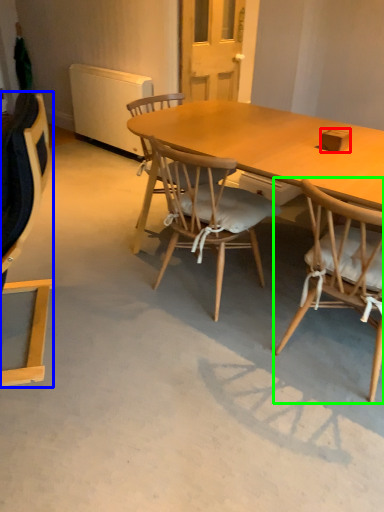
Question: Which is farther away from box (highlighted by a red box)? chair (highlighted by a blue box) or chair (highlighted by a green box)?

Choices:
 (A) chair
 (B) chair

Answer: (A)